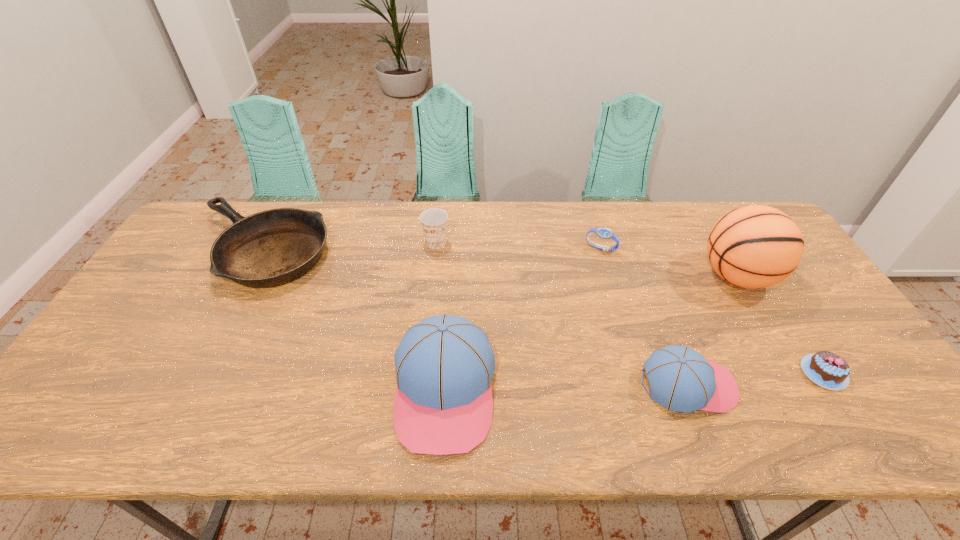
Image resolution: width=960 pixels, height=540 pixels. I want to click on vacant area that lies between the watch and the left baseball cap, so click(522, 319).

The height and width of the screenshot is (540, 960). Find the location of `vacant space that is in between the chocolate cake and the watch`. vacant space that is in between the chocolate cake and the watch is located at coordinates point(712,310).

Identify the location of vacant space that's between the frying pan and the shorter baseball cap. The height and width of the screenshot is (540, 960). (475, 317).

Locate an element on the screen. The width and height of the screenshot is (960, 540). unoccupied area between the chocolate cake and the watch is located at coordinates (712, 310).

Locate an element on the screen. This screenshot has height=540, width=960. vacant area between the chocolate cake and the tallest object is located at coordinates (780, 325).

Locate which object ranks third in proximity to the leftmost object. Please provide its 2D coordinates. Your answer should be formatted as a tuple, i.e. [(x, y)], where the tuple contains the x and y coordinates of a point satisfying the conditions above.

[(604, 233)]

Select which object appears as the second closest to the leftmost object. Please provide its 2D coordinates. Your answer should be formatted as a tuple, i.e. [(x, y)], where the tuple contains the x and y coordinates of a point satisfying the conditions above.

[(443, 405)]

Identify the location of vacant position in the image that satisfies the following two spatial constraints: 1. on the back side of the leftmost object; 2. on the left side of the Dixie cup. (265, 242).

Where is `free space that satisfies the following two spatial constraints: 1. on the front-facing side of the shorter baseball cap; 2. on the front-facing side of the left baseball cap`? The height and width of the screenshot is (540, 960). free space that satisfies the following two spatial constraints: 1. on the front-facing side of the shorter baseball cap; 2. on the front-facing side of the left baseball cap is located at coordinates (689, 389).

At what (x,y) coordinates should I click in order to perform the action: click on vacant space that satisfies the following two spatial constraints: 1. on the front side of the basketball; 2. on the front-facing side of the shorter baseball cap. Please return your answer as a coordinate pair (x, y). The height and width of the screenshot is (540, 960). Looking at the image, I should click on (800, 384).